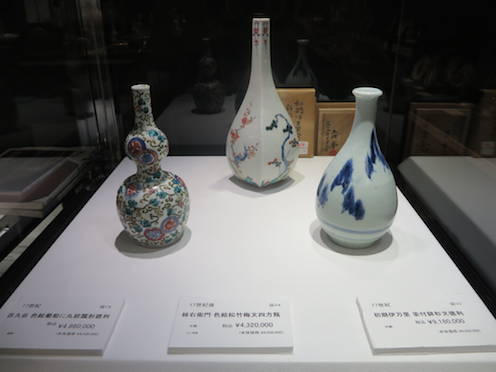
Find the location of a particular element. The image size is (496, 372). table is located at coordinates (325, 294), (458, 201).